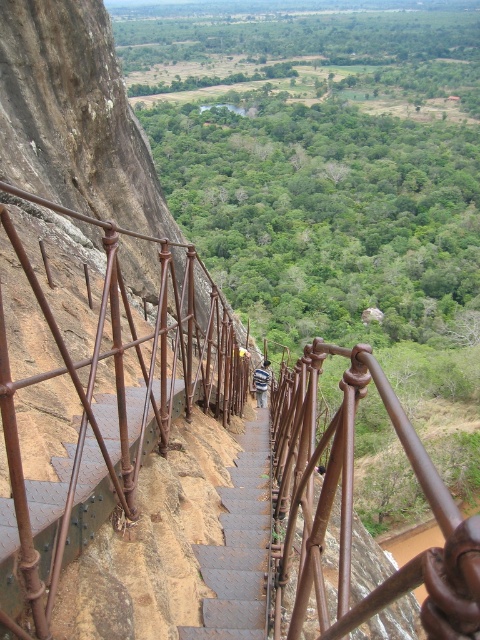
Question: Which of the following is the farthest from the observer?

Choices:
 (A) (180, 397)
 (B) (264, 429)

Answer: (B)

Question: Is rusty metal railing at center closer to camera compared to brown textured stairs at center?

Choices:
 (A) no
 (B) yes

Answer: (B)

Question: Is rusty metal railing at left positioned in front of brown textured stairs at center?

Choices:
 (A) yes
 (B) no

Answer: (A)

Question: Among these objects, which one is farthest from the camera?

Choices:
 (A) brown textured stairs at center
 (B) rusty metal railing at left
 (C) rusty metal railing at center

Answer: (A)

Question: Which of the following is the farthest from the observer?

Choices:
 (A) (314, 579)
 (B) (232, 586)
 (C) (21, 192)

Answer: (B)

Question: Can you confirm if rusty metal railing at center is thinner than brown textured stairs at center?

Choices:
 (A) yes
 (B) no

Answer: (B)